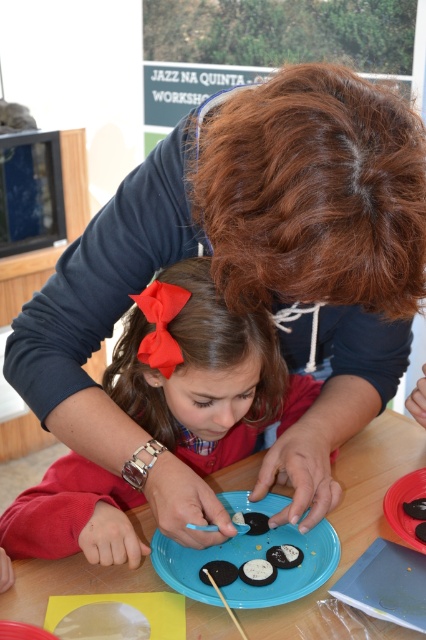
Can you confirm if blue matte plate at center is positioned below black matte platter at center?

Yes.

Does blue matte plate at center come in front of black matte platter at center?

Yes, it is.

This screenshot has height=640, width=426. Describe the element at coordinates (249, 560) in the screenshot. I see `blue matte plate at center` at that location.

This screenshot has width=426, height=640. What are the coordinates of `blue matte plate at center` in the screenshot? It's located at (249, 560).

Measure the distance from wooden table at center to blue matte plate at center.

They are 2.93 inches apart.

Is point (39, 586) closer to camera compared to point (256, 538)?

Yes, it is in front of point (256, 538).

In order to click on wooden table at center in this screenshot , I will do `click(348, 522)`.

Where is `wooden table at center`? The width and height of the screenshot is (426, 640). wooden table at center is located at coordinates (348, 522).

Can you confirm if matte red bow at center is thinner than wooden table at center?

Yes.

Which of these two, matte red bow at center or wooden table at center, stands shorter?

Standing shorter between the two is wooden table at center.

I want to click on matte red bow at center, so click(x=203, y=371).